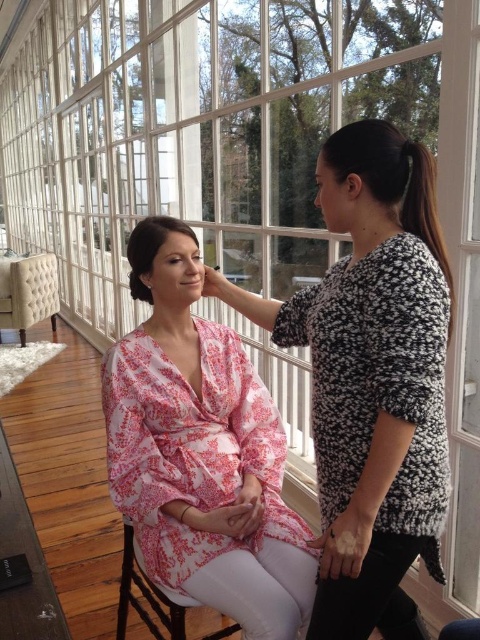
You are a photographer setting up for a photoshoot in the room. You need to position a light source so it illuminates the pink floral dress at center without casting a shadow on the wooden chair at lower center. Is this possible based on the current arrangement?

The pink floral dress at center is in front of the wooden chair at lower center, so placing the light source behind the wooden chair at lower center would cast a shadow of the dress onto the chair. To avoid this, the light should be positioned to the side or above, ensuring the dress is lit while the chair remains in the light as well without shadow overlap.

You are organizing a photoshoot and need to ensure that the pink floral dress at center and the tufted beige chair at left fit within a 4x6 foot frame. Based on their sizes, will both items fit comfortably in the frame?

The pink floral dress at center occupies less space than the tufted beige chair at left. Since the frame is 4x6 feet, which is a relatively large space, both items should fit comfortably within the frame as the combined space they take up is likely smaller than the frame dimensions.

You are a photographer setting up a shoot in this room. You need to position a 1.8m tall model wearing a pink floral dress at center so that they stand in front of the tufted beige chair at left. Is the model taller than the chair?

The pink floral dress at center is much taller than the tufted beige chair at left, so yes, the model wearing the pink floral dress at center will be taller than the tufted beige chair at left.